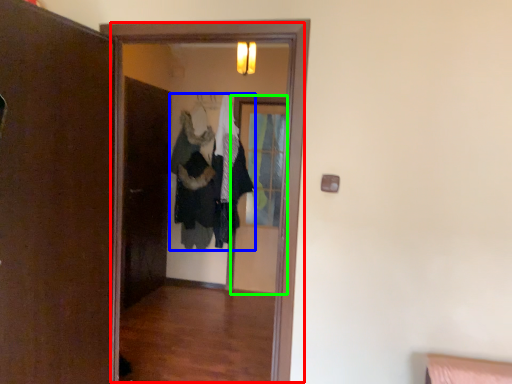
Question: Considering the real-world distances, which object is closest to screen door (highlighted by a red box)? clothing (highlighted by a blue box) or screen door (highlighted by a green box).

Choices:
 (A) clothing
 (B) screen door

Answer: (A)